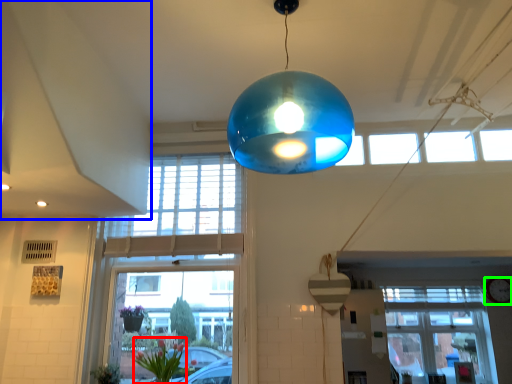
Question: Which object is positioned closest to floral arrangement (highlighted by a red box)? Select from exhaust hood (highlighted by a blue box) and clock (highlighted by a green box).

Choices:
 (A) exhaust hood
 (B) clock

Answer: (A)